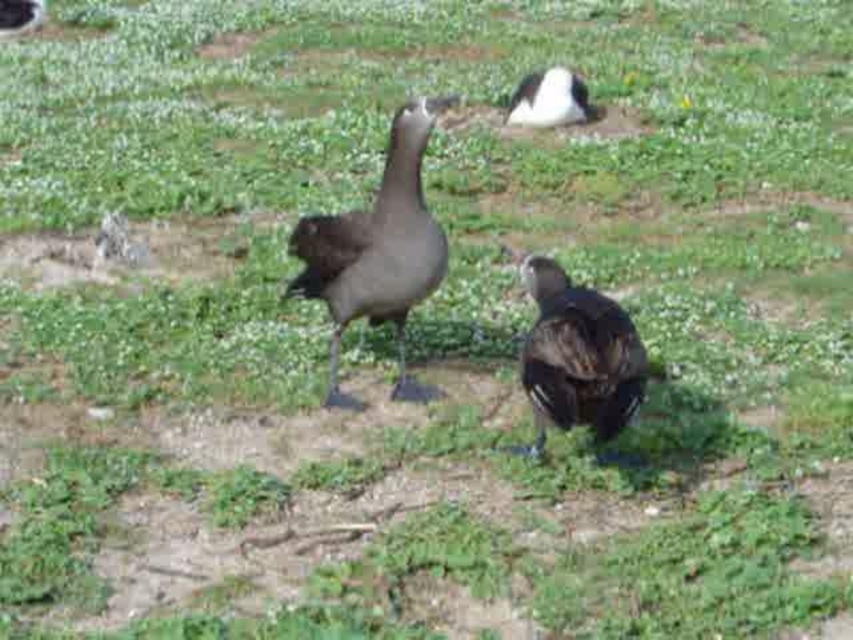
From the picture: You are a birdwatcher observing the scene. You notice two birds in the image. Which of the two birds, the dark brown feathers at center or the white fluffy duck at upper center, is located more to the left side?

The dark brown feathers at center is positioned on the left side of white fluffy duck at upper center, so the dark brown feathers at center is more to the left side.

You are a wildlife photographer trying to capture a closeup shot of the dark brown feathers at center and the white fluffy duck at upper center. Since you want both subjects in focus, you need to know which one is closer to the camera. Can you determine which bird is nearer to the camera?

The dark brown feathers at center has a larger size compared to white fluffy duck at upper center, so the dark brown feathers at center is closer to the camera because objects closer to the lens appear larger in the photo.

You are a wildlife photographer aiming to capture a closeup shot of both the dark gray matte duck at center and the dark brown feathers at center. Given that your camera has a maximum focus range of 27 inches, will you be able to photograph both subjects without moving the camera?

The dark gray matte duck at center and dark brown feathers at center are 26.99 inches apart from each other, so yes, the camera can focus on both subjects since the distance between them is within the 27 inches maximum focus range.